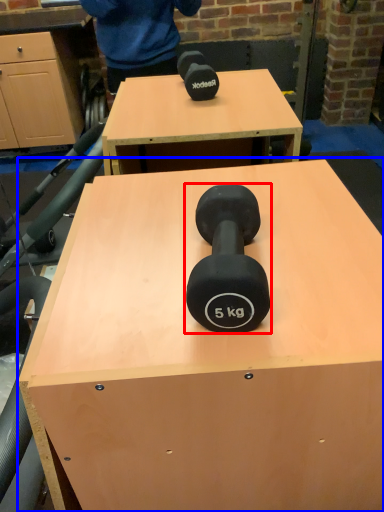
Question: Which object appears closest to the camera in this image, dumbbell (highlighted by a red box) or table (highlighted by a blue box)?

Choices:
 (A) dumbbell
 (B) table

Answer: (A)